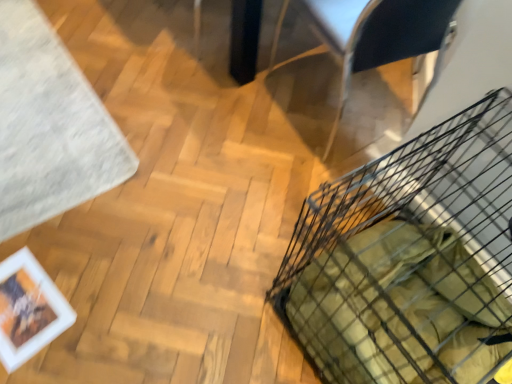
Locate an element on the screen. The width and height of the screenshot is (512, 384). white soft rug at upper left is located at coordinates (49, 126).

Describe the element at coordinates (410, 259) in the screenshot. The height and width of the screenshot is (384, 512). I see `black wire basket at lower right` at that location.

Locate an element on the screen. This screenshot has height=384, width=512. white matte picture frame at lower left is located at coordinates (28, 309).

From the image's perspective, is metallic silver armchair at upper right on top of white matte picture frame at lower left?

Yes, from the image's perspective, metallic silver armchair at upper right is on top of white matte picture frame at lower left.

Does metallic silver armchair at upper right appear on the right side of white matte picture frame at lower left?

Indeed, metallic silver armchair at upper right is positioned on the right side of white matte picture frame at lower left.

Does metallic silver armchair at upper right come in front of white matte picture frame at lower left?

Yes, metallic silver armchair at upper right is closer to the camera.

From a real-world perspective, is metallic silver armchair at upper right on white matte picture frame at lower left?

Yes, from a real-world perspective, metallic silver armchair at upper right is on top of white matte picture frame at lower left.

Is black wire basket at lower right taller or shorter than metallic silver armchair at upper right?

black wire basket at lower right is shorter than metallic silver armchair at upper right.

Considering the relative positions of black wire basket at lower right and metallic silver armchair at upper right in the image provided, is black wire basket at lower right to the left or to the right of metallic silver armchair at upper right?

black wire basket at lower right is to the right of metallic silver armchair at upper right.

Is black wire basket at lower right looking in the opposite direction of metallic silver armchair at upper right?

black wire basket at lower right does not have its back to metallic silver armchair at upper right.

Is black wire basket at lower right not close to metallic silver armchair at upper right?

No, black wire basket at lower right is in close proximity to metallic silver armchair at upper right.

Considering the sizes of objects white matte picture frame at lower left and black wire basket at lower right in the image provided, who is taller, white matte picture frame at lower left or black wire basket at lower right?

Standing taller between the two is black wire basket at lower right.

From the image's perspective, is white matte picture frame at lower left over black wire basket at lower right?

No, from the image's perspective, white matte picture frame at lower left is not on top of black wire basket at lower right.

Would you say white matte picture frame at lower left is outside black wire basket at lower right?

Indeed, white matte picture frame at lower left is completely outside black wire basket at lower right.

How distant is white soft rug at upper left from white matte picture frame at lower left?

A distance of 16.75 inches exists between white soft rug at upper left and white matte picture frame at lower left.

From the picture: Is white soft rug at upper left not inside white matte picture frame at lower left?

Yes, white soft rug at upper left is located beyond the bounds of white matte picture frame at lower left.

From the picture: Which is in front, white soft rug at upper left or white matte picture frame at lower left?

white matte picture frame at lower left.

Is white soft rug at upper left far from white matte picture frame at lower left?

white soft rug at upper left is actually quite close to white matte picture frame at lower left.

How distant is black wire basket at lower right from white soft rug at upper left?

39.04 inches.

Does point (486, 134) come behind point (65, 58)?

No, it is not.

Considering the relative sizes of black wire basket at lower right and white soft rug at upper left in the image provided, is black wire basket at lower right smaller than white soft rug at upper left?

No, black wire basket at lower right is not smaller than white soft rug at upper left.

From a real-world perspective, is black wire basket at lower right positioned over white soft rug at upper left based on gravity?

Correct, in the physical world, black wire basket at lower right is higher than white soft rug at upper left.

From the picture: Which of these two, white matte picture frame at lower left or white soft rug at upper left, stands taller?

Standing taller between the two is white soft rug at upper left.

From the image's perspective, which is above, white matte picture frame at lower left or white soft rug at upper left?

From the image's view, white soft rug at upper left is above.

In the image, is white matte picture frame at lower left positioned in front of or behind white soft rug at upper left?

Visually, white matte picture frame at lower left is located in front of white soft rug at upper left.

This screenshot has height=384, width=512. Find the location of `mat above the black wire basket at lower right (from the image's perspective)`. mat above the black wire basket at lower right (from the image's perspective) is located at coordinates (49, 126).

From the image's perspective, is white soft rug at upper left located beneath black wire basket at lower right?

Actually, white soft rug at upper left appears above black wire basket at lower right in the image.

Is white soft rug at upper left wider than black wire basket at lower right?

No.

In the scene shown: Can you confirm if white soft rug at upper left is shorter than black wire basket at lower right?

Yes.

The width and height of the screenshot is (512, 384). I want to click on armchair above the white matte picture frame at lower left (from the image's perspective), so click(x=362, y=73).

Locate an element on the screen. This screenshot has height=384, width=512. basket in front of the metallic silver armchair at upper right is located at coordinates coord(410,259).

Estimate the real-world distances between objects in this image. Which object is further from metallic silver armchair at upper right, white matte picture frame at lower left or white soft rug at upper left?

white matte picture frame at lower left is positioned further to the anchor metallic silver armchair at upper right.

Estimate the real-world distances between objects in this image. Which object is closer to white soft rug at upper left, white matte picture frame at lower left or black wire basket at lower right?

white matte picture frame at lower left lies closer to white soft rug at upper left than the other object.

Estimate the real-world distances between objects in this image. Which object is further from metallic silver armchair at upper right, black wire basket at lower right or white matte picture frame at lower left?

white matte picture frame at lower left is positioned further to the anchor metallic silver armchair at upper right.

Considering their positions, is white matte picture frame at lower left positioned further to white soft rug at upper left than metallic silver armchair at upper right?

Among the two, metallic silver armchair at upper right is located further to white soft rug at upper left.

When comparing their distances from black wire basket at lower right, does white soft rug at upper left or metallic silver armchair at upper right seem closer?

Based on the image, metallic silver armchair at upper right appears to be nearer to black wire basket at lower right.

Considering their positions, is metallic silver armchair at upper right positioned further to white matte picture frame at lower left than black wire basket at lower right?

metallic silver armchair at upper right is further to white matte picture frame at lower left.

Estimate the real-world distances between objects in this image. Which object is closer to white soft rug at upper left, metallic silver armchair at upper right or black wire basket at lower right?

metallic silver armchair at upper right is positioned closer to the anchor white soft rug at upper left.

Consider the image. Based on their spatial positions, is white soft rug at upper left or black wire basket at lower right closer to white matte picture frame at lower left?

Answer: white soft rug at upper left lies closer to white matte picture frame at lower left than the other object.

I want to click on armchair between white soft rug at upper left and black wire basket at lower right in the horizontal direction, so coord(362,73).

Identify the location of picture frame between white soft rug at upper left and black wire basket at lower right in the horizontal direction. The width and height of the screenshot is (512, 384). (28, 309).

At what (x,y) coordinates should I click in order to perform the action: click on armchair between white matte picture frame at lower left and black wire basket at lower right in the horizontal direction. Please return your answer as a coordinate pair (x, y). Image resolution: width=512 pixels, height=384 pixels. Looking at the image, I should click on (362, 73).

Image resolution: width=512 pixels, height=384 pixels. In order to click on picture frame situated between white soft rug at upper left and metallic silver armchair at upper right from left to right in this screenshot , I will do `click(28, 309)`.